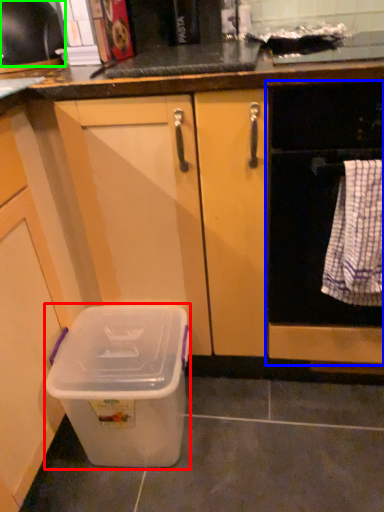
Question: Which is nearer to the storage box (highlighted by a red box)? home appliance (highlighted by a blue box) or kitchen appliance (highlighted by a green box).

Choices:
 (A) home appliance
 (B) kitchen appliance

Answer: (A)